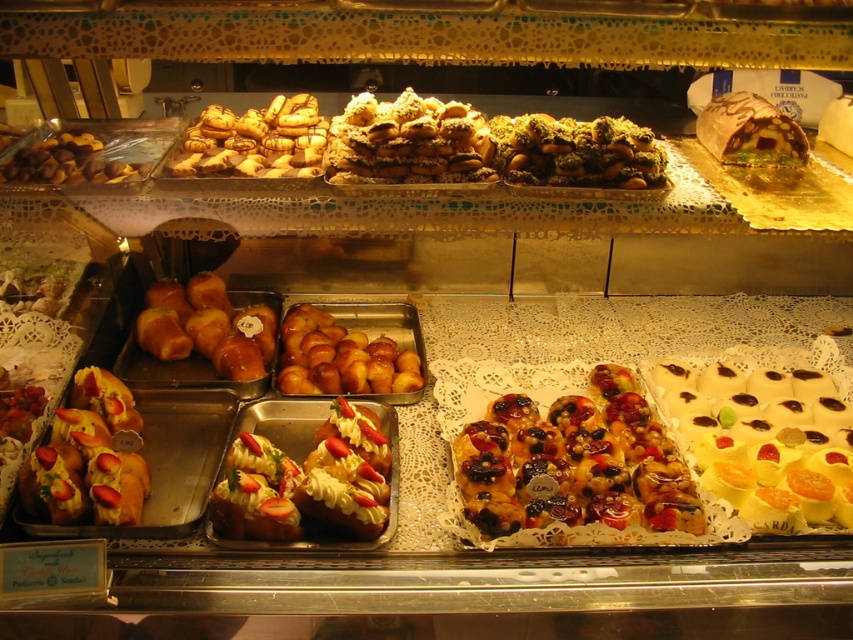
Question: Among these objects, which one is farthest from the camera?

Choices:
 (A) brown matte nuts at left
 (B) glazed fruit pastry at center
 (C) matte golden croissant at upper left

Answer: (C)

Question: Among these points, which one is nearest to the camera?

Choices:
 (A) (395, 378)
 (B) (517, 436)
 (C) (39, 179)

Answer: (C)

Question: Does matte golden croissant at upper left have a larger size compared to brown matte nuts at left?

Choices:
 (A) no
 (B) yes

Answer: (B)

Question: Which point is closer to the camera?

Choices:
 (A) brown matte nuts at left
 (B) glazed fruit pastry at center
 (C) strawberry-topped bread at lower left
 (D) matte golden croissant at upper left

Answer: (C)

Question: Observing the image, what is the correct spatial positioning of glossy golden buns at center in reference to brown matte nuts at left?

Choices:
 (A) left
 (B) right

Answer: (B)

Question: Is glossy glazed pastry at center-left behind matte golden croissant at upper left?

Choices:
 (A) yes
 (B) no

Answer: (A)